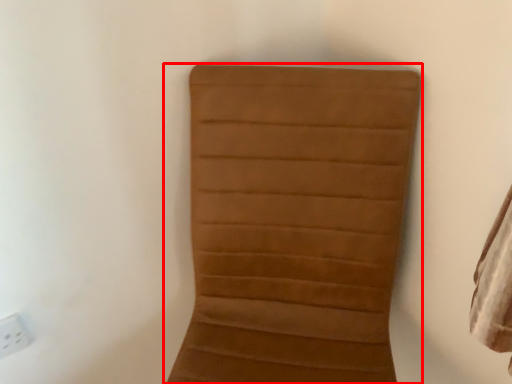
Question: Considering the relative positions of furniture (annotated by the red box) and electric outlet in the image provided, where is furniture (annotated by the red box) located with respect to the staircase?

Choices:
 (A) right
 (B) left

Answer: (A)